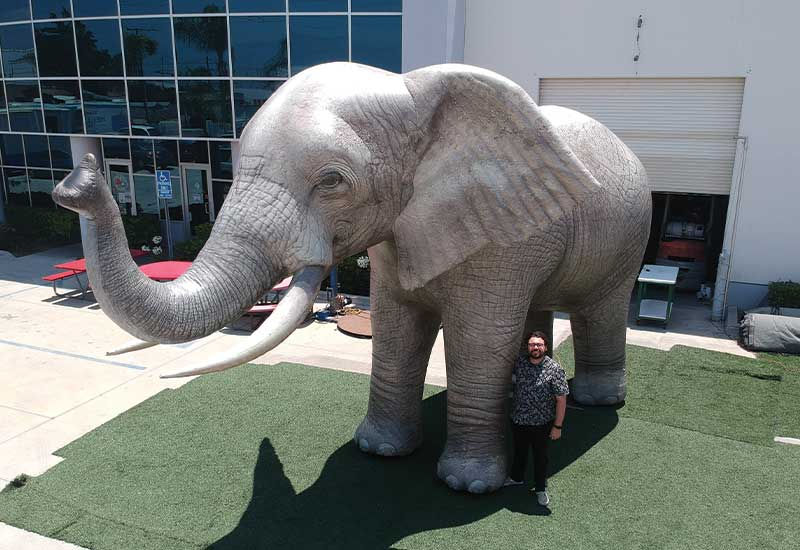
Locate an element on the screen. Image resolution: width=800 pixels, height=550 pixels. visible seats is located at coordinates (61, 275).